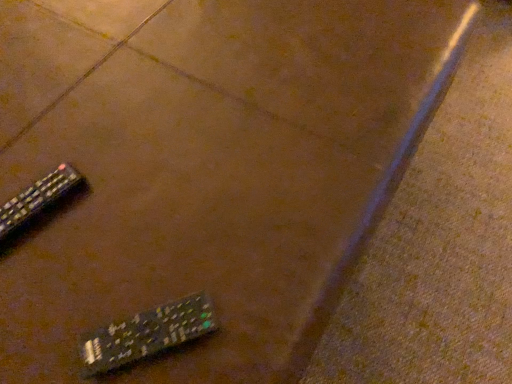
At what (x,y) coordinates should I click in order to perform the action: click on blank space to the left of black plastic remote at lower left, which appears as the 2th remote control when viewed from the left. Please return your answer as a coordinate pair (x, y). The height and width of the screenshot is (384, 512). Looking at the image, I should click on (58, 297).